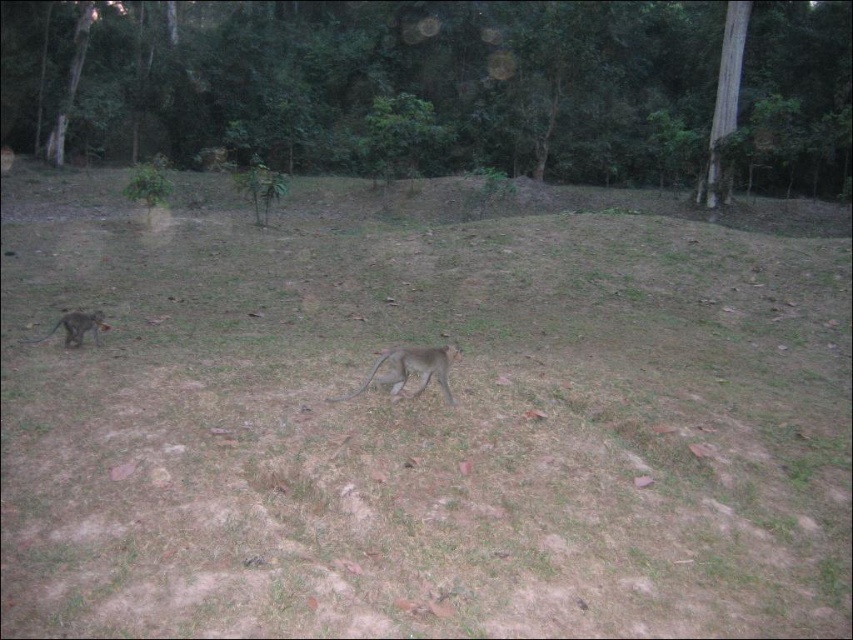
Which is behind, point (416, 392) or point (67, 340)?

Point (67, 340)

Does point (392, 362) come behind point (102, 326)?

No, (392, 362) is in front of (102, 326).

Which is behind, point (447, 355) or point (74, 314)?

The point (74, 314) is behind.

The height and width of the screenshot is (640, 853). What are the coordinates of `gray furry monkey at center` in the screenshot? It's located at (410, 369).